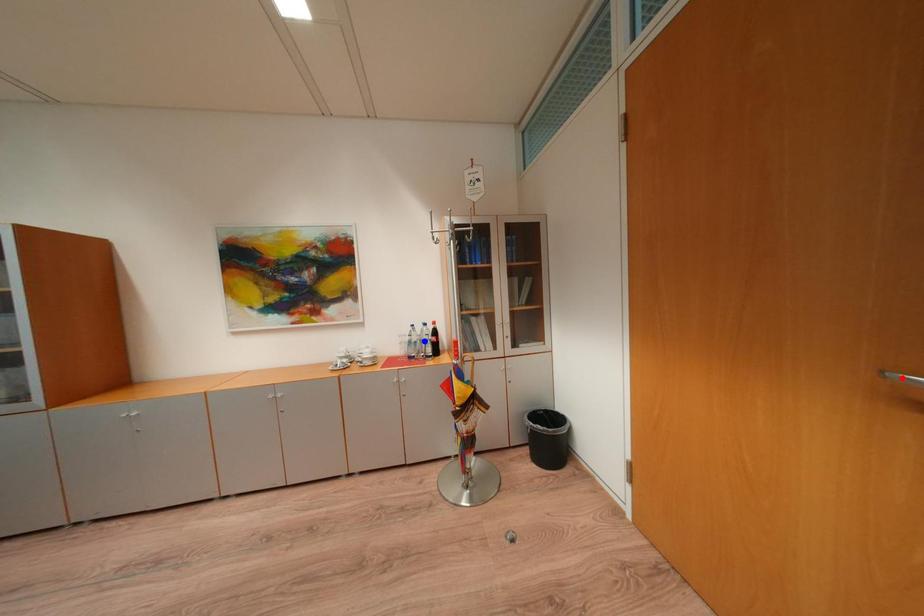
Question: Two points are marked on the image. Which point is closer to the camera?

Choices:
 (A) Blue point is closer.
 (B) Red point is closer.

Answer: (B)